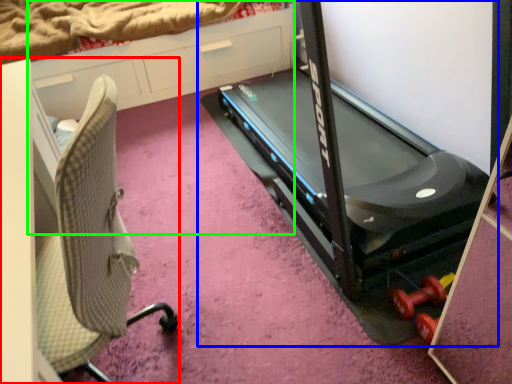
Question: Estimate the real-world distances between objects in this image. Which object is closer to furniture (highlighted by a red box), treadmill (highlighted by a blue box) or dresser (highlighted by a green box)?

Choices:
 (A) treadmill
 (B) dresser

Answer: (A)